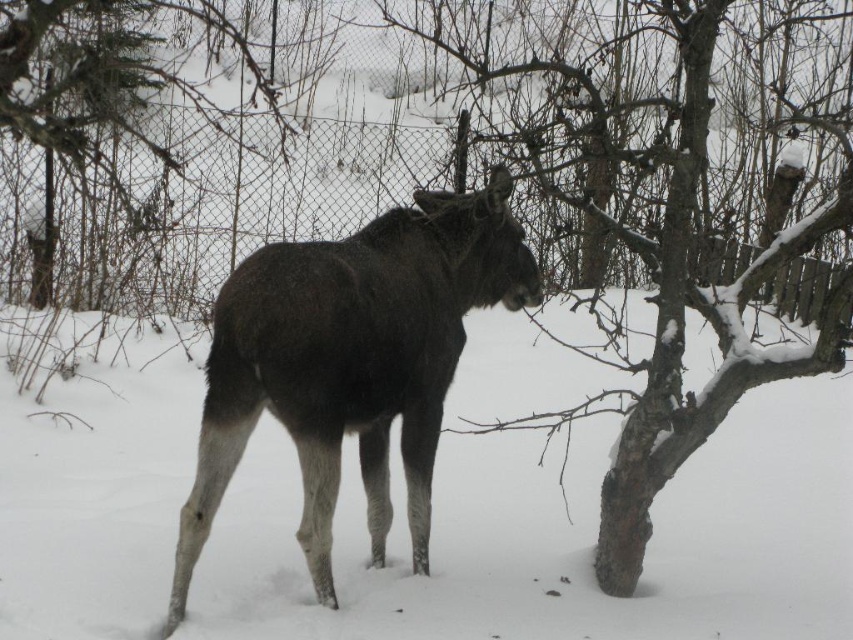
You are a wildlife photographer aiming to capture the moose in the snowy environment. You notice a point at coordinates point (199, 209). What object is located at this point?

The point (199, 209) corresponds to the wire mesh fence at center.